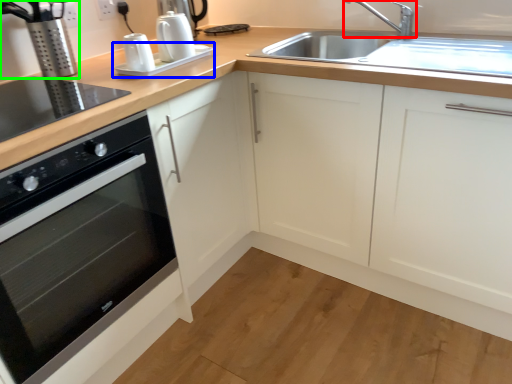
Question: Which is farther away from tap (highlighted by a red box)? appliance (highlighted by a blue box) or coffee machine (highlighted by a green box)?

Choices:
 (A) appliance
 (B) coffee machine

Answer: (B)